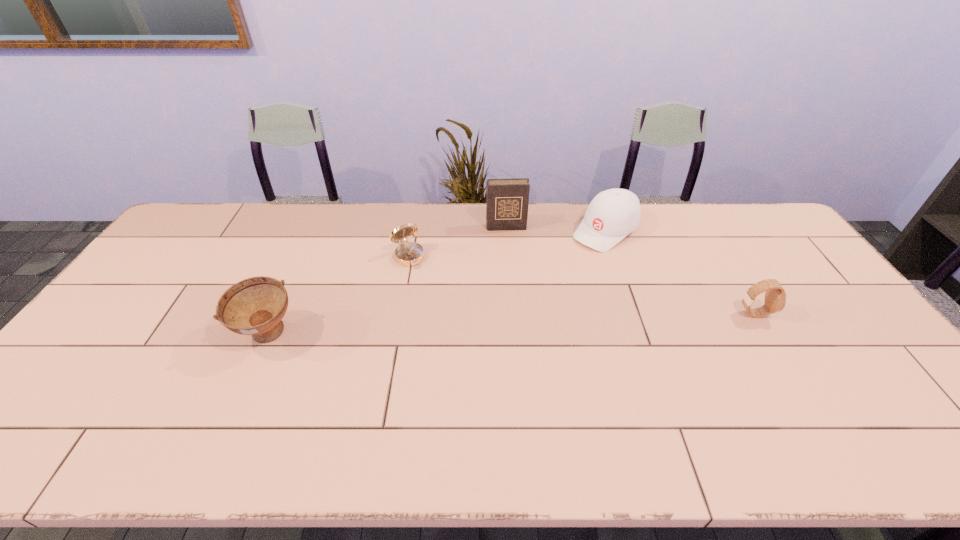
The width and height of the screenshot is (960, 540). Identify the location of the leftmost object. (255, 306).

You are a GUI agent. You are given a task and a screenshot of the screen. Output one action in this format:
    pyautogui.click(x=<x>, y=<y>)
    Task: Click on the watch
    Image resolution: width=960 pixels, height=540 pixels.
    Given the screenshot: What is the action you would take?
    pyautogui.click(x=775, y=297)

Locate an element on the screen. The width and height of the screenshot is (960, 540). compass is located at coordinates (407, 253).

In order to click on the second object from right to left in this screenshot , I will do `click(613, 214)`.

You are a GUI agent. You are given a task and a screenshot of the screen. Output one action in this format:
    pyautogui.click(x=<x>, y=<y>)
    Task: Click on the third object from left to right
    The height and width of the screenshot is (540, 960).
    Given the screenshot: What is the action you would take?
    pyautogui.click(x=507, y=200)

Find the location of a particular element. The height and width of the screenshot is (540, 960). diary is located at coordinates (507, 200).

This screenshot has width=960, height=540. Find the location of `free space located on the back of the leftmost object`. free space located on the back of the leftmost object is located at coordinates (306, 252).

Find the location of a particular element. This screenshot has height=540, width=960. blank area located 0.180m on the face of the watch is located at coordinates (830, 314).

Where is `vacant region located 0.100m with the dial facing the fourth object from right to left`? The width and height of the screenshot is (960, 540). vacant region located 0.100m with the dial facing the fourth object from right to left is located at coordinates (428, 286).

This screenshot has width=960, height=540. I want to click on vacant space located 0.130m with the dial facing the fourth object from right to left, so click(432, 293).